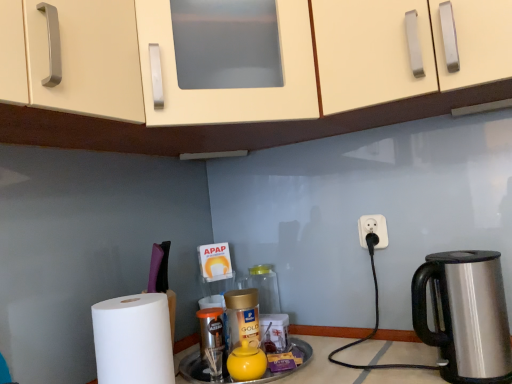
In order to click on free space to the left of gold plastic bottle at center, which ranks as the 1th bottle in front-to-back order in this screenshot , I will do coord(196,365).